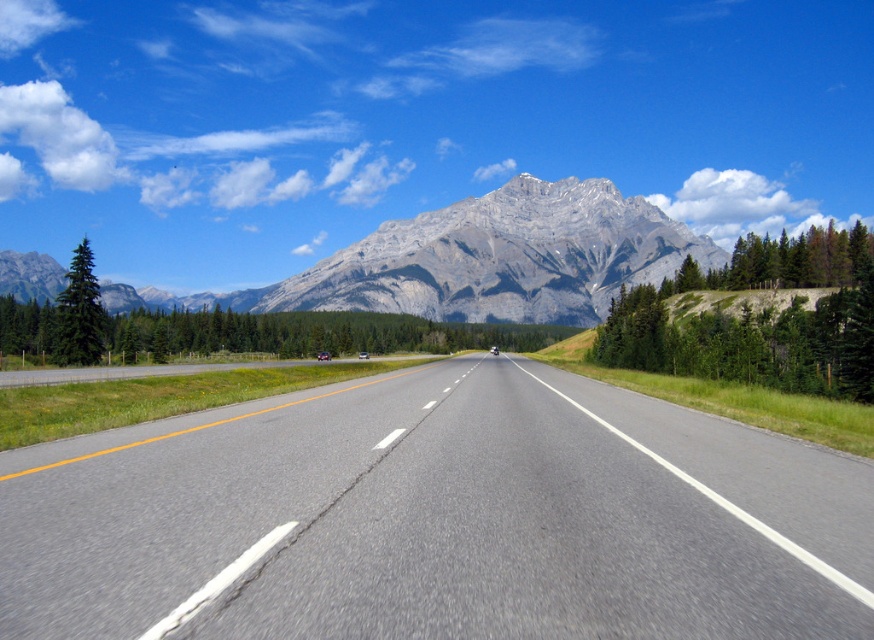
You are driving a car and see the asphalt road at center and the green matte tree at left. Which object is located to the right of the other?

The asphalt road at center is positioned on the right side of green matte tree at left.

You are driving a car that is 5 meters long. You see the asphalt road at center and the green matte tree at left. Can your car fit completely between them without touching either?

The asphalt road at center and green matte tree at left are 62.26 meters apart from each other. Since your car is only 5 meters long, it can easily fit between them without touching either.

You are driving a car and need to stay on the asphalt road at center. There is a green matte tree at left near the road. Based on the scene, which side of the road is the tree located relative to the road?

The green matte tree at left is located above the asphalt road at center, so it is on the left side of the road.